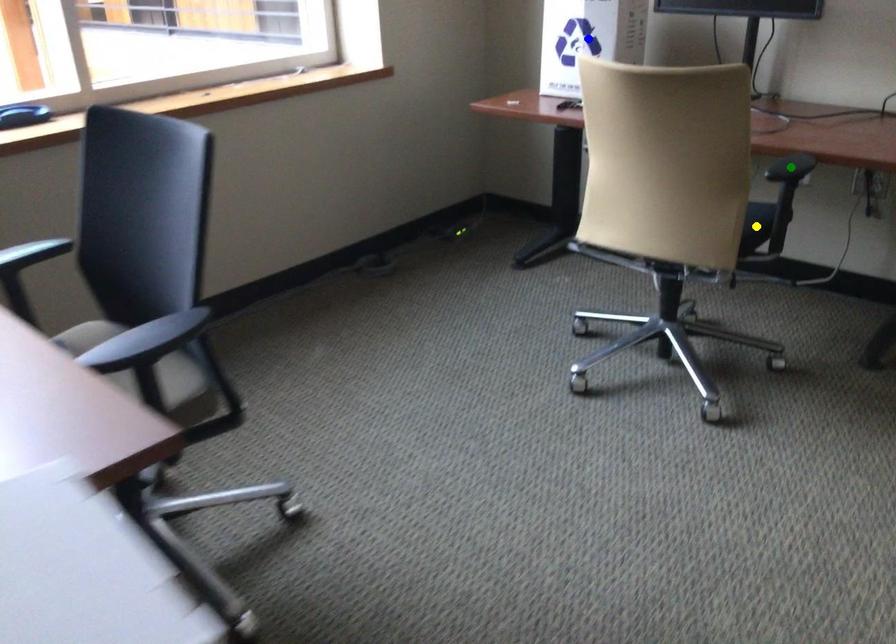
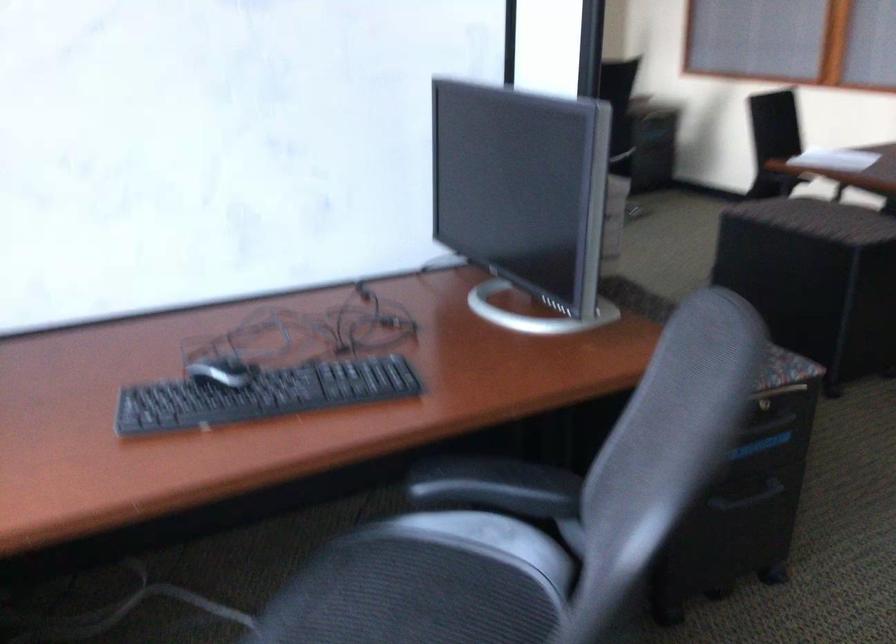
I am providing you with two images of the same scene from different viewpoints. Three points are marked in image1. Which point corresponds to a part or object that is occluded in image2?In image1, three points are marked. Which of them correspond to a part or object that is occluded in image2?Among the three points shown in image1, which one corresponds to a part or object that is no longer visible due to occlusion in image2?

green point, yellow point, blue point cannot be seen in image2.